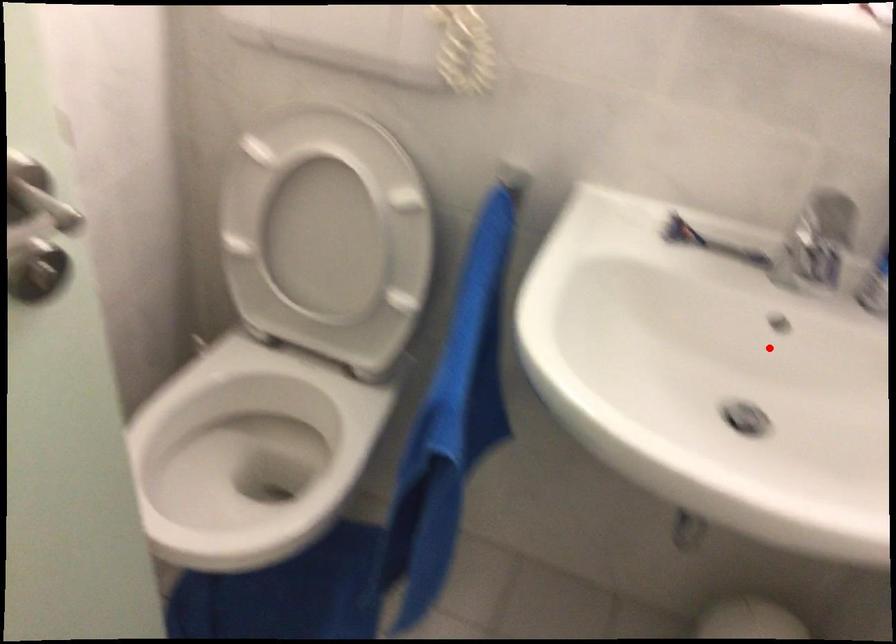
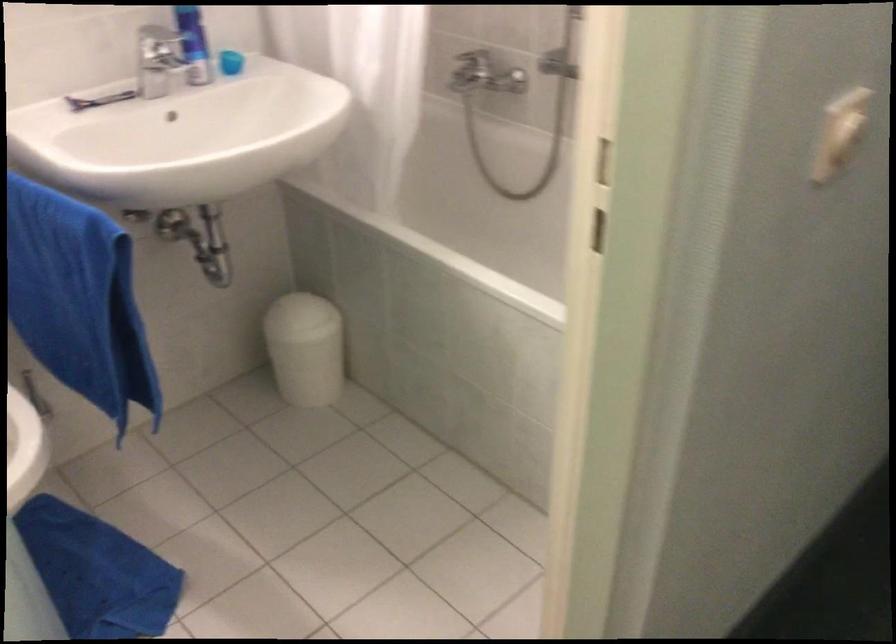
Find the pixel in the second image that matches the highlighted location in the first image.

(183, 137)